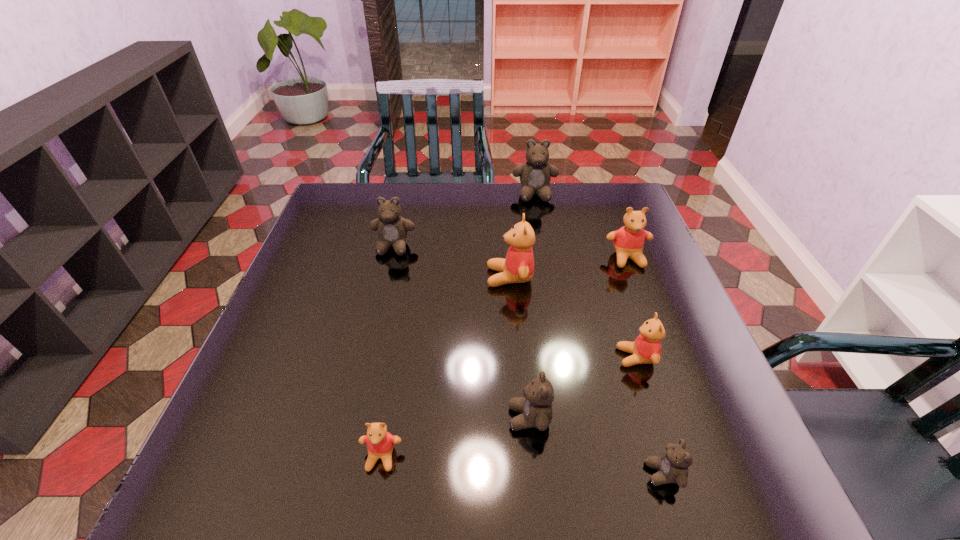
You are a GUI agent. You are given a task and a screenshot of the screen. Output one action in this format:
    pyautogui.click(x=<x>, y=<y>)
    Task: Click on the unoccupied position between the third red teddy bear from right to left and the leftmost brown teddy bear
    
    Given the screenshot: What is the action you would take?
    pyautogui.click(x=451, y=262)

The width and height of the screenshot is (960, 540). I want to click on vacant area between the biggest red teddy bear and the leftmost red teddy bear, so click(445, 367).

At what (x,y) coordinates should I click in order to perform the action: click on vacant area between the biggest red teddy bear and the third smallest brown teddy bear. Please return your answer as a coordinate pair (x, y). The image size is (960, 540). Looking at the image, I should click on (451, 262).

You are a GUI agent. You are given a task and a screenshot of the screen. Output one action in this format:
    pyautogui.click(x=<x>, y=<y>)
    Task: Click on the free space between the third farthest brown teddy bear and the rightmost brown teddy bear
    
    Given the screenshot: What is the action you would take?
    pyautogui.click(x=596, y=446)

This screenshot has width=960, height=540. Identify the location of object that can be found as the fourth closest to the fourth nearest teddy bear. (628, 241).

Select which object appears as the fourth closest to the smallest brown teddy bear. Please provide its 2D coordinates. Your answer should be formatted as a tuple, i.e. [(x, y)], where the tuple contains the x and y coordinates of a point satisfying the conditions above.

[(380, 443)]

Identify which teddy bear is the third nearest to the leftmost red teddy bear. Please provide its 2D coordinates. Your answer should be formatted as a tuple, i.e. [(x, y)], where the tuple contains the x and y coordinates of a point satisfying the conditions above.

[(672, 467)]

The image size is (960, 540). What are the coordinates of `teddy bear that is the second closest one to the biggest red teddy bear` in the screenshot? It's located at (628, 241).

Identify which brown teddy bear is the nearest to the fourth nearest teddy bear. Please provide its 2D coordinates. Your answer should be formatted as a tuple, i.e. [(x, y)], where the tuple contains the x and y coordinates of a point satisfying the conditions above.

[(672, 467)]

Identify the location of brown teddy bear object that ranks as the third closest to the third biggest red teddy bear. (535, 174).